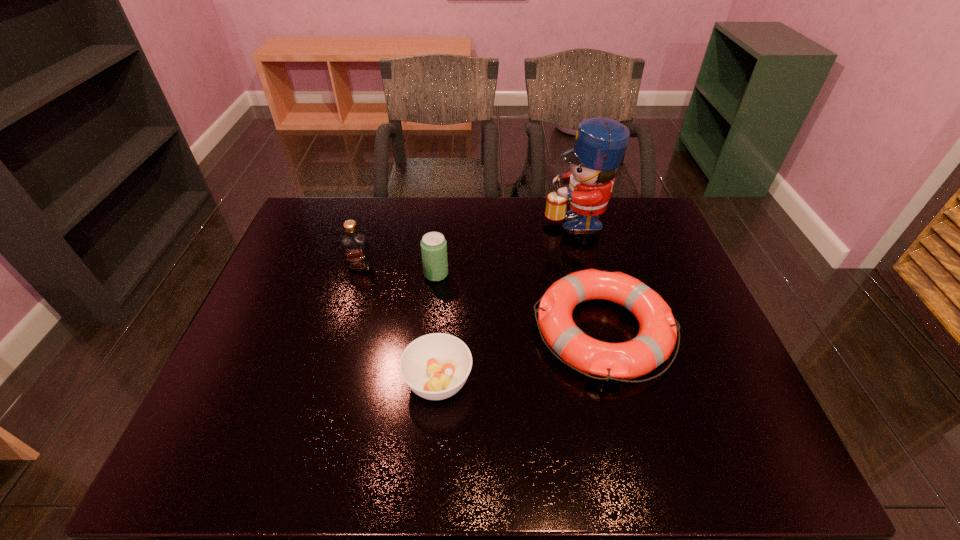
Image resolution: width=960 pixels, height=540 pixels. I want to click on free space at the far right corner, so click(x=642, y=197).

The height and width of the screenshot is (540, 960). Identify the location of vacant space in between the soup bowl and the tallest object. (507, 300).

The width and height of the screenshot is (960, 540). Identify the location of free space between the soda and the life buoy. (519, 302).

Find the location of a particular element. This screenshot has width=960, height=540. empty space that is in between the life buoy and the soup bowl is located at coordinates (520, 356).

Identify the location of vacant area that lies between the soup bowl and the life buoy. (520, 356).

This screenshot has width=960, height=540. In order to click on vacant space that is in between the life buoy and the third tallest object in this screenshot , I will do `click(519, 302)`.

The width and height of the screenshot is (960, 540). Find the location of `vacant area that lies between the leftmost object and the life buoy`. vacant area that lies between the leftmost object and the life buoy is located at coordinates (482, 299).

Where is `vacant area that lies between the farthest object and the soup bowl`? The image size is (960, 540). vacant area that lies between the farthest object and the soup bowl is located at coordinates (507, 300).

This screenshot has width=960, height=540. Identify the location of empty space between the life buoy and the soup bowl. (520, 356).

Find the location of a particular element. free space between the third tallest object and the soup bowl is located at coordinates (437, 328).